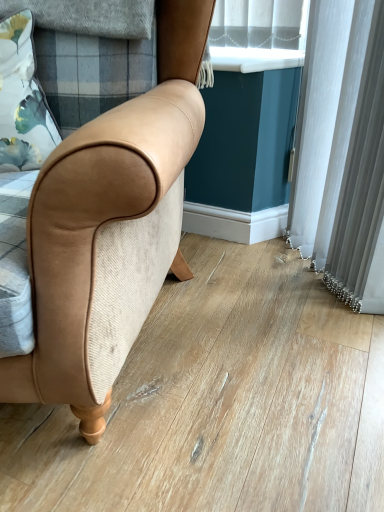
Find the location of a particular element. vacant area on top of white plastic window sill at upper center (from a real-world perspective) is located at coordinates (253, 50).